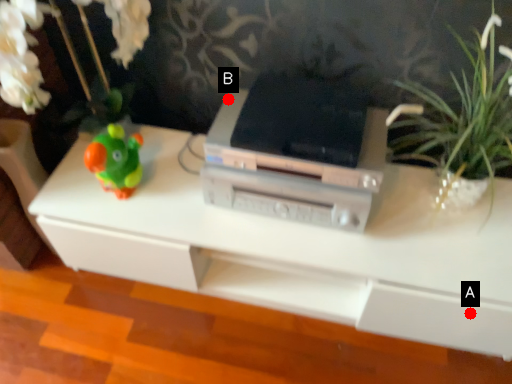
Question: Two points are circled on the image, labeled by A and B beside each circle. Which point is farther from the camera taking this photo?

Choices:
 (A) A is further
 (B) B is further

Answer: (B)